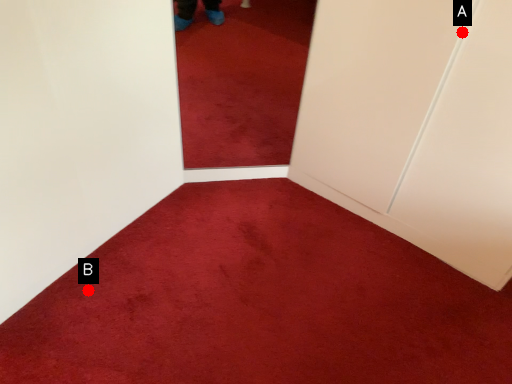
Question: Two points are circled on the image, labeled by A and B beside each circle. Which point is farther to the camera?

Choices:
 (A) A is further
 (B) B is further

Answer: (B)